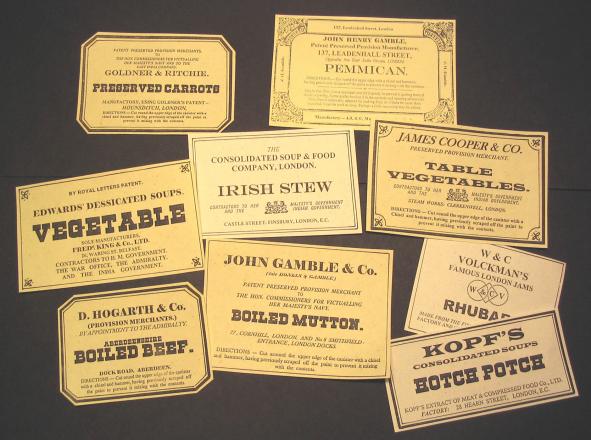
Find the location of `papers`. papers is located at coordinates (168, 90), (368, 71), (298, 170), (122, 220), (163, 318), (292, 291), (422, 358), (478, 288), (457, 184).